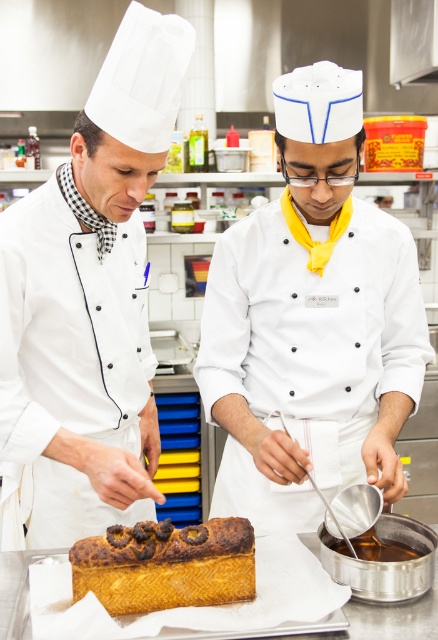
You are a food critic who needs to determine which item is larger between the white glossy chef hat at center and the golden brown sponge cake at center. Based on the scene, which one is larger?

The white glossy chef hat at center is bigger than the golden brown sponge cake at center, so the white glossy chef hat at center is larger.

You are a food critic standing in the kitchen and want to describe the position of the white glossy chef hat at center relative to the golden brown sponge cake at center. Which one is higher?

The white glossy chef hat at center is located above the golden brown sponge cake at center, so the white glossy chef hat at center is higher.

You are a food critic who just entered the kitchen and noticed two chefs wearing different hats. You see the white glossy chef hat at center and the white matte chef hat at left. Which chef hat is located to the right of the other?

The white glossy chef hat at center is positioned on the right side of the white matte chef hat at left.